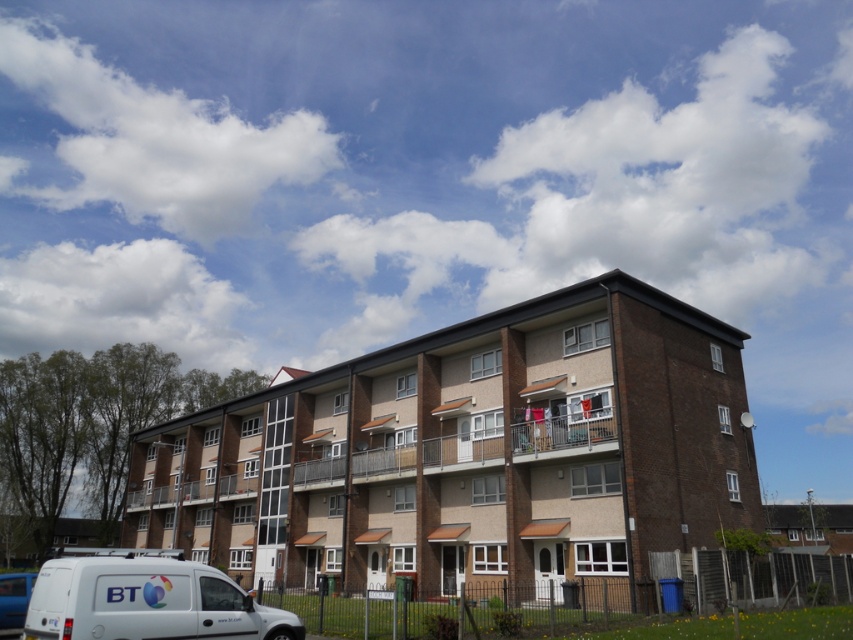
Question: Is white matte van at lower left thinner than blue metallic van at lower left?

Choices:
 (A) yes
 (B) no

Answer: (B)

Question: Which of the following is the farthest from the observer?

Choices:
 (A) blue metallic van at lower left
 (B) white matte van at lower left

Answer: (A)

Question: Is white matte van at lower left thinner than blue metallic van at lower left?

Choices:
 (A) yes
 (B) no

Answer: (B)

Question: From the image, what is the correct spatial relationship of white matte van at lower left in relation to blue metallic van at lower left?

Choices:
 (A) below
 (B) above

Answer: (A)

Question: Which point is farther to the camera?

Choices:
 (A) white matte van at lower left
 (B) blue metallic van at lower left

Answer: (B)